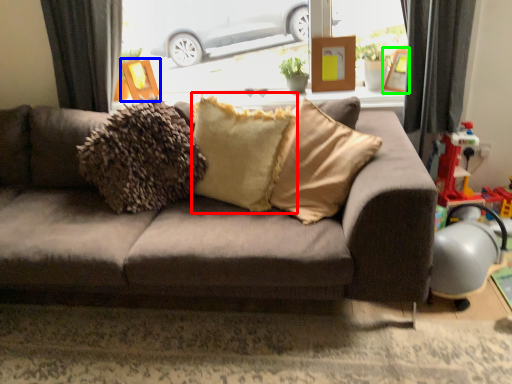
Question: Which object is positioned farthest from pillow (highlighted by a red box)? Select from picture frame (highlighted by a blue box) and picture frame (highlighted by a green box).

Choices:
 (A) picture frame
 (B) picture frame

Answer: (B)